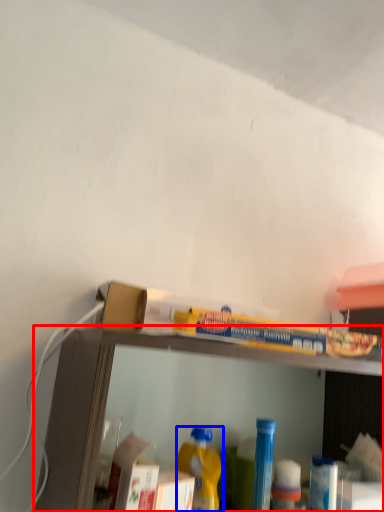
Question: Which of the following is the farthest to the observer, shelf (highlighted by a red box) or bottle (highlighted by a blue box)?

Choices:
 (A) shelf
 (B) bottle

Answer: (B)